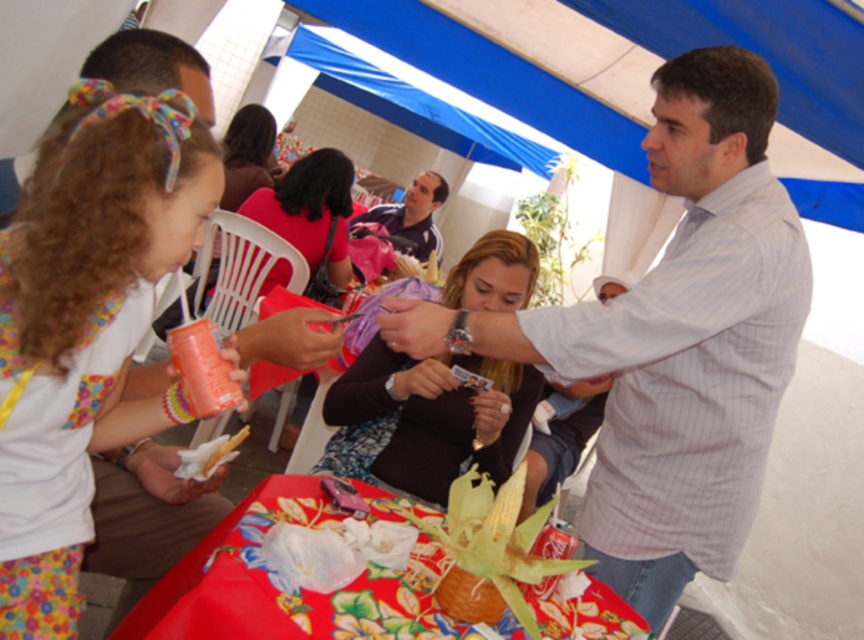
Question: Does white striped shirt at center appear on the left side of matte pink shirt at center?

Choices:
 (A) yes
 (B) no

Answer: (B)

Question: Which of these objects is positioned closest to the matte pink shirt at center?

Choices:
 (A) matte brown sweater at center
 (B) white striped shirt at center
 (C) floral fabric dress at left
 (D) floral printed fabric at lower center

Answer: (A)

Question: Among these objects, which one is farthest from the camera?

Choices:
 (A) matte pink shirt at center
 (B) matte brown sweater at center
 (C) matte black shirt at center
 (D) floral fabric dress at left

Answer: (C)

Question: Which point is farther to the camera?

Choices:
 (A) matte black shirt at center
 (B) floral printed fabric at lower center
 (C) floral fabric dress at left
 (D) white striped shirt at center

Answer: (A)

Question: Does matte brown sweater at center lie behind floral printed fabric at lower center?

Choices:
 (A) no
 (B) yes

Answer: (B)

Question: Is floral fabric dress at left to the right of matte brown sweater at center from the viewer's perspective?

Choices:
 (A) yes
 (B) no

Answer: (B)